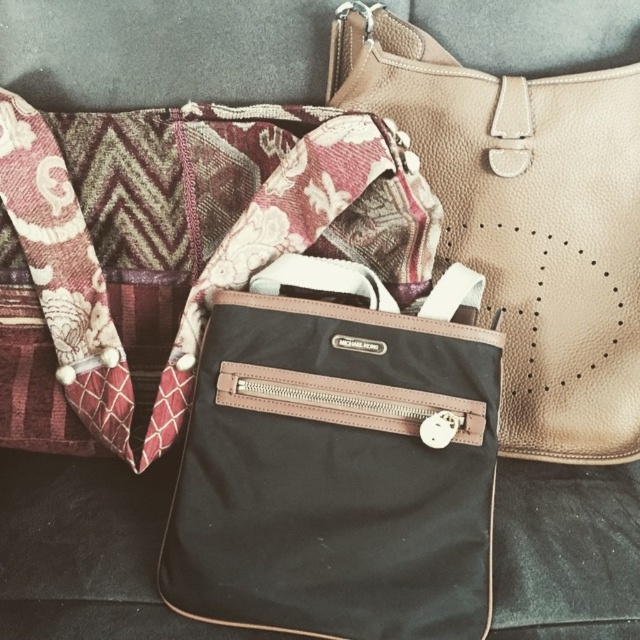
You are standing in front of a dark fabric surface with a black nylon bag at center. Where is the black nylon bag located?

The black nylon bag at center is located at point (339, 460).

You are organizing a small display and need to place the black nylon bag at center and the matte beige leather shoulder bag at upper right side by side. Based on their sizes, which one should be placed first to ensure they fit properly?

The black nylon bag at center is wider than the matte beige leather shoulder bag at upper right. Therefore, you should place the black nylon bag at center first to accommodate its larger size before positioning the smaller matte beige leather shoulder bag at upper right.